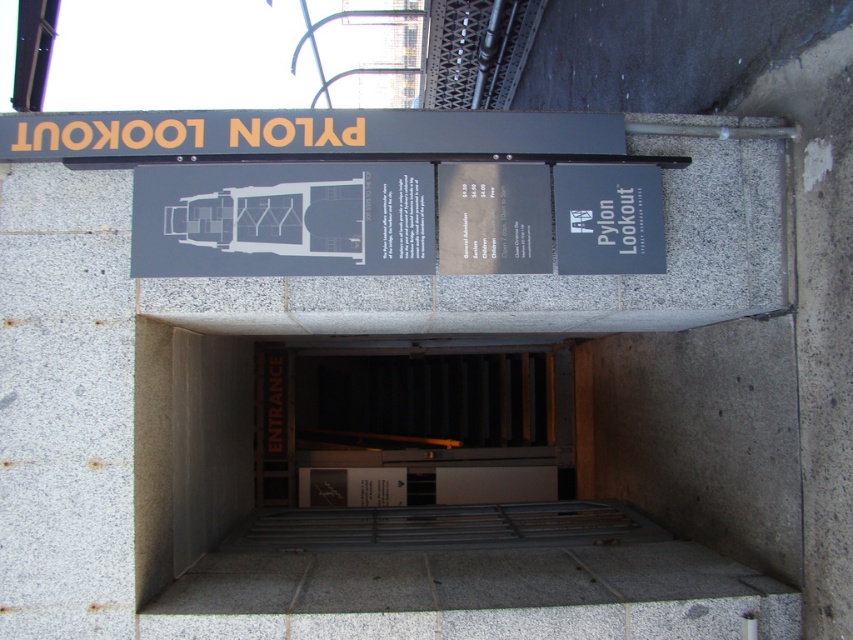
Who is more forward, (428, 492) or (233, 244)?

Point (233, 244) is more forward.

Is metallic gray door at center below gray matte sign at center?

Yes, metallic gray door at center is below gray matte sign at center.

Which is behind, point (442, 442) or point (352, 272)?

The point (442, 442) is behind.

Locate an element on the screen. metallic gray door at center is located at coordinates (412, 428).